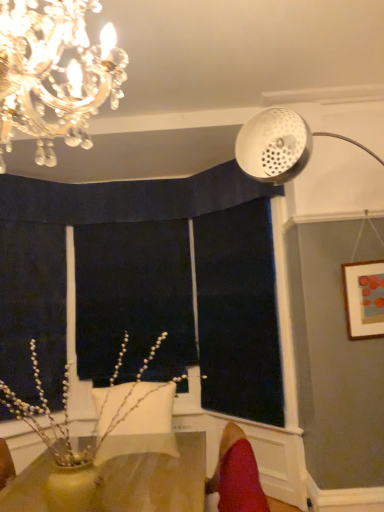
The height and width of the screenshot is (512, 384). What are the coordinates of `red velvet swivel chair at lower right` in the screenshot? It's located at tap(237, 475).

The image size is (384, 512). Describe the element at coordinates (53, 72) in the screenshot. I see `crystal chandelier at upper left` at that location.

Where is `crystal chandelier at upper left`? The width and height of the screenshot is (384, 512). crystal chandelier at upper left is located at coordinates [x=53, y=72].

Where is `black fabric at center, the second window screen in the right-to-left sequence`? The width and height of the screenshot is (384, 512). black fabric at center, the second window screen in the right-to-left sequence is located at coordinates (133, 298).

What do you see at coordinates (133, 298) in the screenshot? This screenshot has width=384, height=512. I see `black fabric at center, marked as the first window screen in a left-to-right arrangement` at bounding box center [133, 298].

Identify the location of matte yellow vase at lower center. The width and height of the screenshot is (384, 512). (118, 478).

Where is `red velvet swivel chair at lower right`? red velvet swivel chair at lower right is located at coordinates (237, 475).

Between black fabric at center, marked as the first window screen in a left-to-right arrangement, and white pearlized branches at lower left, which one has larger width?

white pearlized branches at lower left is wider.

From the image's perspective, which is above, black fabric at center, marked as the first window screen in a left-to-right arrangement, or white pearlized branches at lower left?

black fabric at center, marked as the first window screen in a left-to-right arrangement.

How many degrees apart are the facing directions of black fabric at center, marked as the first window screen in a left-to-right arrangement, and white pearlized branches at lower left?

The angle between the facing direction of black fabric at center, marked as the first window screen in a left-to-right arrangement, and the facing direction of white pearlized branches at lower left is 3.03 degrees.

Does black fabric at center, marked as the first window screen in a left-to-right arrangement, turn towards white pearlized branches at lower left?

Yes, black fabric at center, marked as the first window screen in a left-to-right arrangement, is aimed at white pearlized branches at lower left.

Which is farther, (x=276, y=421) or (x=366, y=263)?

The point (x=276, y=421) is farther.

Considering their positions, is dark blue fabric at center, which ranks as the first window screen in right-to-left order, located in front of or behind matte white picture frame at upper right?

dark blue fabric at center, which ranks as the first window screen in right-to-left order, is positioned farther from the viewer than matte white picture frame at upper right.

Consider the image. Between dark blue fabric at center, which is counted as the 2th window screen, starting from the left, and matte white picture frame at upper right, which one has more height?

With more height is dark blue fabric at center, which is counted as the 2th window screen, starting from the left.

Consider the image. Is dark blue fabric at center, which ranks as the first window screen in right-to-left order, not close to matte white picture frame at upper right?

dark blue fabric at center, which ranks as the first window screen in right-to-left order, is near matte white picture frame at upper right, not far away.

Is white pearlized branches at lower left looking in the opposite direction of crystal chandelier at upper left?

No, white pearlized branches at lower left is not facing the opposite direction of crystal chandelier at upper left.

Which point is more distant from viewer, (20, 400) or (119, 77)?

Positioned behind is point (20, 400).

Is white pearlized branches at lower left wider or thinner than crystal chandelier at upper left?

Considering their sizes, white pearlized branches at lower left looks broader than crystal chandelier at upper left.

Is matte yellow vase at lower center outside of black fabric at center, marked as the first window screen in a left-to-right arrangement?

Indeed, matte yellow vase at lower center is completely outside black fabric at center, marked as the first window screen in a left-to-right arrangement.

Does point (179, 469) appear closer or farther from the camera than point (141, 320)?

Clearly, point (179, 469) is closer to the camera than point (141, 320).

From a real-world perspective, is matte yellow vase at lower center positioned above or below black fabric at center, marked as the first window screen in a left-to-right arrangement?

From a real-world perspective, matte yellow vase at lower center is physically below black fabric at center, marked as the first window screen in a left-to-right arrangement.

Between matte yellow vase at lower center and black fabric at center, marked as the first window screen in a left-to-right arrangement, which one has larger width?

matte yellow vase at lower center is wider.

Considering the relative sizes of black fabric at center, the second window screen in the right-to-left sequence, and matte white picture frame at upper right in the image provided, is black fabric at center, the second window screen in the right-to-left sequence, bigger than matte white picture frame at upper right?

Correct, black fabric at center, the second window screen in the right-to-left sequence, is larger in size than matte white picture frame at upper right.

Is black fabric at center, the second window screen in the right-to-left sequence, not inside matte white picture frame at upper right?

black fabric at center, the second window screen in the right-to-left sequence, lies outside matte white picture frame at upper right's area.

What's the angular difference between black fabric at center, marked as the first window screen in a left-to-right arrangement, and matte white picture frame at upper right's facing directions?

The angle between the facing direction of black fabric at center, marked as the first window screen in a left-to-right arrangement, and the facing direction of matte white picture frame at upper right is 0.132 degrees.

Who is shorter, black fabric at center, the second window screen in the right-to-left sequence, or matte white picture frame at upper right?

With less height is matte white picture frame at upper right.

Is white pearlized branches at lower left inside the boundaries of matte yellow vase at lower center, or outside?

white pearlized branches at lower left is not enclosed by matte yellow vase at lower center.

Can you confirm if white pearlized branches at lower left is bigger than matte yellow vase at lower center?

Correct, white pearlized branches at lower left is larger in size than matte yellow vase at lower center.

Between white pearlized branches at lower left and matte yellow vase at lower center, which one has more height?

white pearlized branches at lower left.

Can you confirm if red velvet swivel chair at lower right is thinner than white pearlized branches at lower left?

Yes.

Is red velvet swivel chair at lower right touching white pearlized branches at lower left?

red velvet swivel chair at lower right and white pearlized branches at lower left are clearly separated.

Which is more to the left, red velvet swivel chair at lower right or white pearlized branches at lower left?

white pearlized branches at lower left.

Measure the distance from red velvet swivel chair at lower right to white pearlized branches at lower left.

A distance of 1.08 meters exists between red velvet swivel chair at lower right and white pearlized branches at lower left.

Image resolution: width=384 pixels, height=512 pixels. Identify the location of plant below the black fabric at center, marked as the first window screen in a left-to-right arrangement (from the image's perspective). (98, 413).

Where is `picture frame in front of the dark blue fabric at center, which ranks as the first window screen in right-to-left order`? picture frame in front of the dark blue fabric at center, which ranks as the first window screen in right-to-left order is located at coordinates (364, 298).

Based on their spatial positions, is matte white picture frame at upper right or black fabric at center, the second window screen in the right-to-left sequence, further from crystal chandelier at upper left?

black fabric at center, the second window screen in the right-to-left sequence, is further to crystal chandelier at upper left.

Considering their positions, is crystal chandelier at upper left positioned closer to matte white picture frame at upper right than black fabric at center, the second window screen in the right-to-left sequence?

Based on the image, black fabric at center, the second window screen in the right-to-left sequence, appears to be nearer to matte white picture frame at upper right.

In the scene shown: When comparing their distances from matte yellow vase at lower center, does dark blue fabric at center, which ranks as the first window screen in right-to-left order, or black fabric at center, the second window screen in the right-to-left sequence, seem further?

Based on the image, dark blue fabric at center, which ranks as the first window screen in right-to-left order, appears to be further to matte yellow vase at lower center.

From the image, which object appears to be farther from red velvet swivel chair at lower right, matte yellow vase at lower center or white pearlized branches at lower left?

Among the two, white pearlized branches at lower left is located further to red velvet swivel chair at lower right.

Considering their positions, is red velvet swivel chair at lower right positioned closer to white pearlized branches at lower left than dark blue fabric at center, which is counted as the 2th window screen, starting from the left?

red velvet swivel chair at lower right is positioned closer to the anchor white pearlized branches at lower left.

From the image, which object appears to be nearer to matte yellow vase at lower center, matte white picture frame at upper right or red velvet swivel chair at lower right?

The object closer to matte yellow vase at lower center is red velvet swivel chair at lower right.

Based on their spatial positions, is dark blue fabric at center, which ranks as the first window screen in right-to-left order, or white pearlized branches at lower left further from matte white picture frame at upper right?

white pearlized branches at lower left is further to matte white picture frame at upper right.

Which object lies further to the anchor point black fabric at center, the second window screen in the right-to-left sequence, matte white picture frame at upper right or red velvet swivel chair at lower right?

The object further to black fabric at center, the second window screen in the right-to-left sequence, is red velvet swivel chair at lower right.

You are a GUI agent. You are given a task and a screenshot of the screen. Output one action in this format:
    pyautogui.click(x=<x>, y=<y>)
    Task: Click on the table located between red velvet swivel chair at lower right and dark blue fabric at center, which is counted as the 2th window screen, starting from the left, in the depth direction
    Image resolution: width=384 pixels, height=512 pixels.
    Given the screenshot: What is the action you would take?
    pyautogui.click(x=118, y=478)

This screenshot has width=384, height=512. I want to click on table located between white pearlized branches at lower left and black fabric at center, the second window screen in the right-to-left sequence, in the depth direction, so point(118,478).

This screenshot has height=512, width=384. Identify the location of picture frame located between crystal chandelier at upper left and black fabric at center, the second window screen in the right-to-left sequence, in the depth direction. (364, 298).

Locate an element on the screen. This screenshot has height=512, width=384. picture frame between matte yellow vase at lower center and black fabric at center, marked as the first window screen in a left-to-right arrangement, along the z-axis is located at coordinates (364, 298).